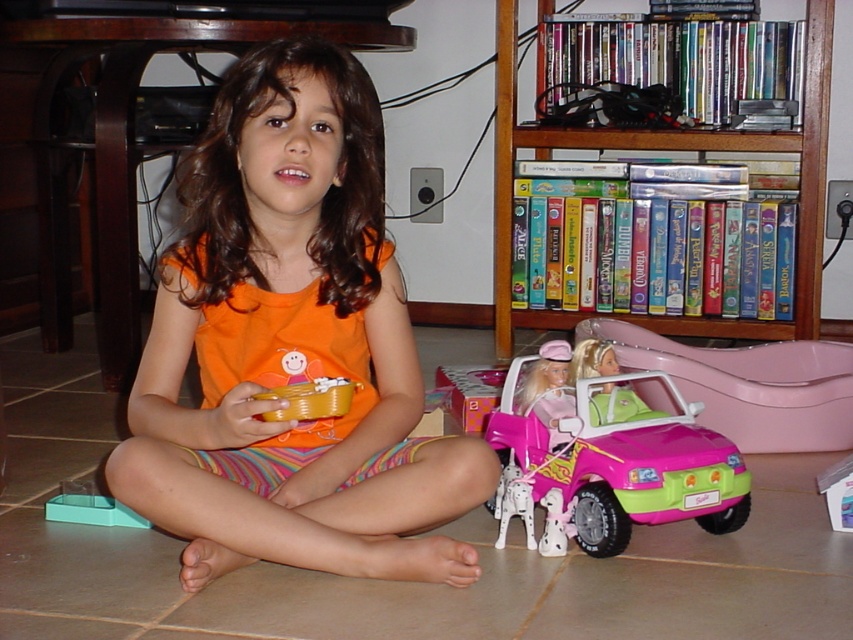
Find the location of `wooden bookshelf at upper right`. wooden bookshelf at upper right is located at coordinates (668, 148).

Between wooden bookshelf at upper right and pink plastic car at lower right, which one has more height?

wooden bookshelf at upper right is taller.

Between point (503, 154) and point (809, 440), which one is positioned in front?

Point (809, 440) is in front.

Find the location of `wooden bookshelf at upper right`. wooden bookshelf at upper right is located at coordinates (668, 148).

Image resolution: width=853 pixels, height=640 pixels. What do you see at coordinates (292, 348) in the screenshot?
I see `orange cotton shirt at center` at bounding box center [292, 348].

Consider the image. Can you confirm if orange cotton shirt at center is positioned above wooden bookshelf at upper right?

No.

Who is more distant from viewer, (346,326) or (508,22)?

Positioned behind is point (508,22).

Locate an element on the screen. This screenshot has height=640, width=853. orange cotton shirt at center is located at coordinates point(292,348).

Which is more to the left, orange cotton shirt at center or pink matte toy car at lower center?

orange cotton shirt at center is more to the left.

Is orange cotton shirt at center shorter than pink matte toy car at lower center?

In fact, orange cotton shirt at center may be taller than pink matte toy car at lower center.

Who is more distant from viewer, (279, 115) or (665, 435)?

Point (665, 435)

Identify the location of orange cotton shirt at center. (292, 348).